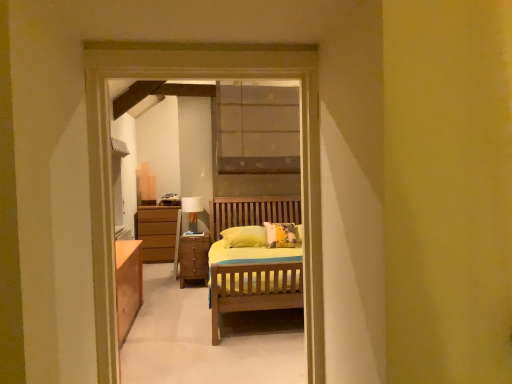
Question: From a real-world perspective, is wooden chest of drawers at center beneath white fabric-covered table lamp at center?

Choices:
 (A) yes
 (B) no

Answer: (A)

Question: From the image's perspective, does wooden chest of drawers at center appear higher than white fabric-covered table lamp at center?

Choices:
 (A) no
 (B) yes

Answer: (A)

Question: Does wooden chest of drawers at center have a larger size compared to white fabric-covered table lamp at center?

Choices:
 (A) no
 (B) yes

Answer: (B)

Question: From the image's perspective, is wooden chest of drawers at center below white fabric-covered table lamp at center?

Choices:
 (A) no
 (B) yes

Answer: (B)

Question: Does wooden chest of drawers at center have a smaller size compared to white fabric-covered table lamp at center?

Choices:
 (A) no
 (B) yes

Answer: (A)

Question: Can you confirm if wooden chest of drawers at center is positioned to the right of white fabric-covered table lamp at center?

Choices:
 (A) no
 (B) yes

Answer: (B)

Question: Is white fabric-covered table lamp at center looking in the opposite direction of wooden chest of drawers at center?

Choices:
 (A) no
 (B) yes

Answer: (A)

Question: From the image's perspective, does white fabric-covered table lamp at center appear lower than wooden chest of drawers at center?

Choices:
 (A) no
 (B) yes

Answer: (A)

Question: Is white fabric-covered table lamp at center at the right side of wooden chest of drawers at center?

Choices:
 (A) no
 (B) yes

Answer: (A)

Question: Is white fabric-covered table lamp at center not inside wooden chest of drawers at center?

Choices:
 (A) no
 (B) yes

Answer: (B)

Question: Does white fabric-covered table lamp at center have a larger size compared to wooden chest of drawers at center?

Choices:
 (A) no
 (B) yes

Answer: (A)

Question: Is white fabric-covered table lamp at center aimed at wooden chest of drawers at center?

Choices:
 (A) yes
 (B) no

Answer: (B)

Question: Considering the positions of white fabric-covered table lamp at center and wooden chest of drawers at center in the image, is white fabric-covered table lamp at center wider or thinner than wooden chest of drawers at center?

Choices:
 (A) wide
 (B) thin

Answer: (B)